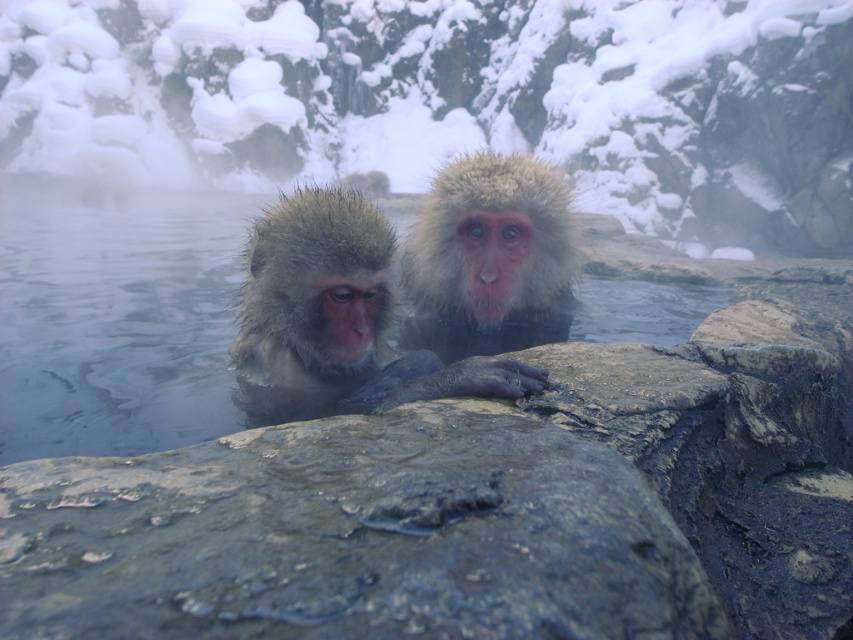
You are a wildlife photographer standing on a snowy path. You want to capture a closeup shot of the fuzzy fur monkey at center without disturbing it. Your camera has a zoom lens that can focus up to 1.5 meters. Can you get a clear closeup shot from your current position?

The fuzzy fur monkey at center is 1.66 meters away from the viewer. Since the camera can only focus up to 1.5 meters, you cannot get a clear closeup shot from your current position.

Based on the photo, you are a wildlife photographer observing two monkeys in a hot spring. You have a camera with a zoom lens. Which monkey, the fuzzy fur monkey at center or the fuzzy white fur monkey at center, would you need to zoom in more on to capture a closeup of its face?

The fuzzy fur monkey at center has a lesser height compared to the fuzzy white fur monkey at center, so you would need to zoom in more on the fuzzy fur monkey at center to capture a closeup of its face since it is smaller in size.

From the picture: You are a researcher studying the spatial distribution of snow monkeys in their natural habitat. You observe a fuzzy fur monkey at center in the hot spring. Based on its coordinates, can you determine if it is positioned closer to the center of the hot spring or near the edge?

The fuzzy fur monkey at center is located at point [316,308], which is very close to the center coordinates of the image. Therefore, it is positioned near the center of the hot spring.